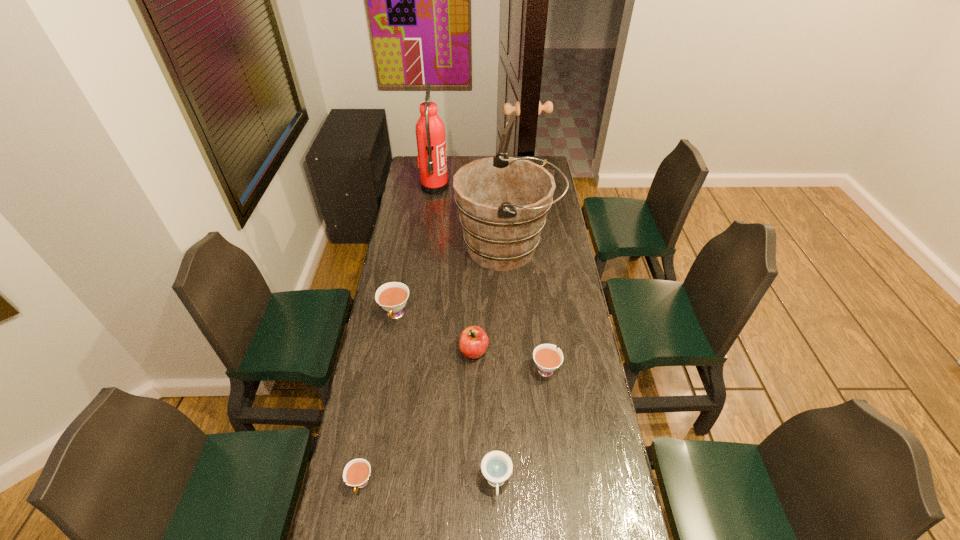
Where is `fire extinguisher situated at the far edge`? fire extinguisher situated at the far edge is located at coordinates (430, 133).

You are a GUI agent. You are given a task and a screenshot of the screen. Output one action in this format:
    pyautogui.click(x=<x>, y=<y>)
    Task: Click on the phonograph record that is at the far edge
    The height and width of the screenshot is (540, 960).
    Given the screenshot: What is the action you would take?
    pos(506,134)

Locate an element on the screen. This screenshot has height=540, width=960. fire extinguisher that is at the left edge is located at coordinates (430, 133).

The image size is (960, 540). Find the location of `bucket that is positioned at the right edge`. bucket that is positioned at the right edge is located at coordinates (503, 201).

Locate an element on the screen. phonograph record present at the right edge is located at coordinates (506, 134).

Find the location of a particular element. This screenshot has width=960, height=540. teacup that is at the right edge is located at coordinates (547, 358).

This screenshot has height=540, width=960. What are the coordinates of `object that is positioned at the far left corner` in the screenshot? It's located at (430, 133).

Identify the location of object present at the far right corner. (506, 134).

Locate an element on the screen. free spot at the left edge of the desktop is located at coordinates (403, 282).

Where is `vacant space at the right edge of the desktop`? This screenshot has width=960, height=540. vacant space at the right edge of the desktop is located at coordinates (555, 198).